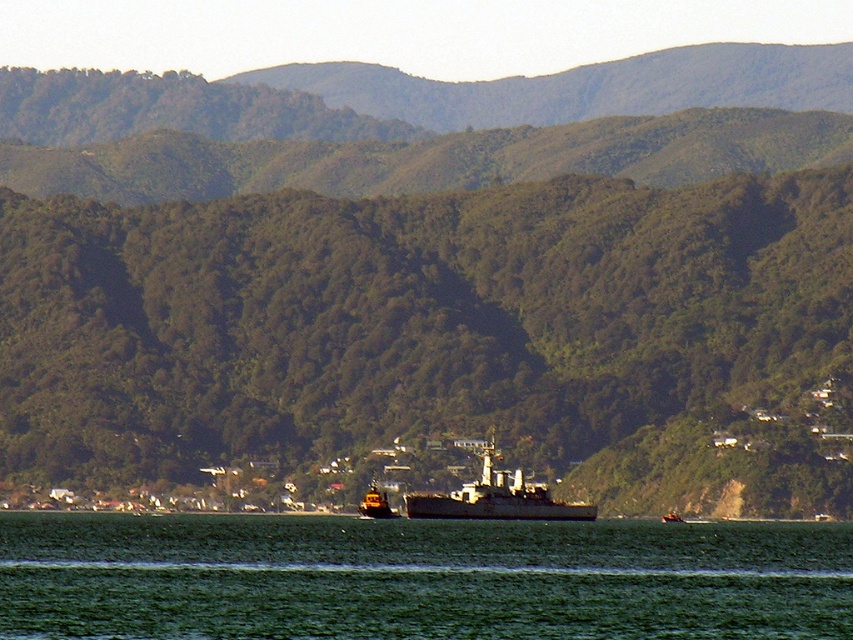
Question: Does gray metallic ship at center have a greater width compared to yellow rubber boat at center?

Choices:
 (A) yes
 (B) no

Answer: (A)

Question: Which point appears closest to the camera in this image?

Choices:
 (A) (363, 506)
 (B) (183, 621)

Answer: (B)

Question: Is green water at lower center below gray metallic ship at center?

Choices:
 (A) yes
 (B) no

Answer: (A)

Question: Which object is farther from the camera taking this photo?

Choices:
 (A) gray metallic ship at center
 (B) yellow rubber boat at center

Answer: (B)

Question: Does green water at lower center come behind gray metallic ship at center?

Choices:
 (A) no
 (B) yes

Answer: (A)

Question: Which object is the farthest from the gray metallic ship at center?

Choices:
 (A) yellow rubber boat at center
 (B) green water at lower center

Answer: (B)